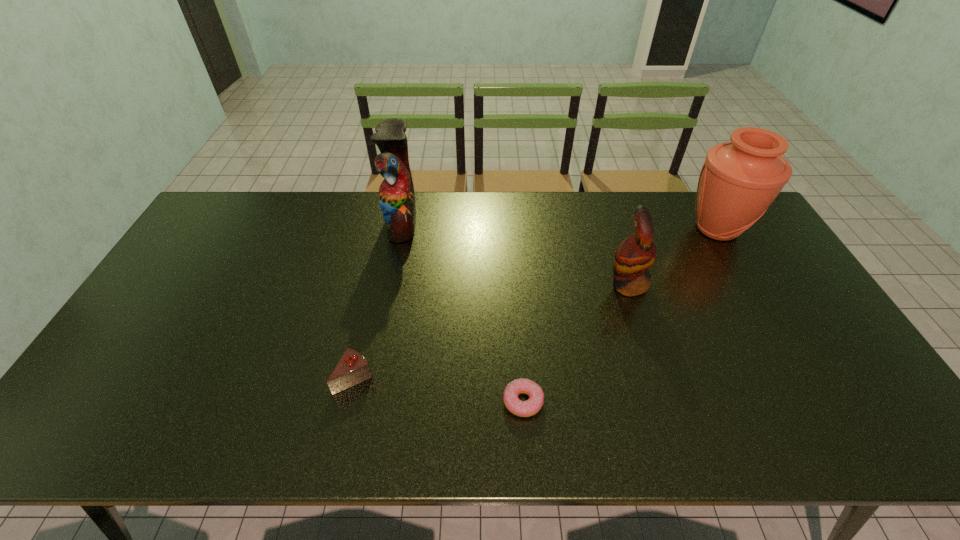
I want to click on vase, so click(x=739, y=180).

In order to click on the left parrot in this screenshot , I will do click(396, 195).

This screenshot has height=540, width=960. I want to click on the farther parrot, so click(396, 195).

The height and width of the screenshot is (540, 960). Find the location of `the third shortest object`. the third shortest object is located at coordinates (636, 254).

The height and width of the screenshot is (540, 960). Find the location of `the third nearest object`. the third nearest object is located at coordinates (636, 254).

The width and height of the screenshot is (960, 540). What are the coordinates of `the fourth tallest object` in the screenshot? It's located at (352, 368).

Where is `doughnut`? doughnut is located at coordinates (530, 407).

Locate an element on the screen. the shortest object is located at coordinates click(x=530, y=407).

I want to click on free space located on the front of the vase, so (740, 270).

You are a GUI agent. You are given a task and a screenshot of the screen. Output one action in this format:
    pyautogui.click(x=<x>, y=<y>)
    Task: Click on the vacant area located at the face of the left parrot
    
    Given the screenshot: What is the action you would take?
    pyautogui.click(x=470, y=221)